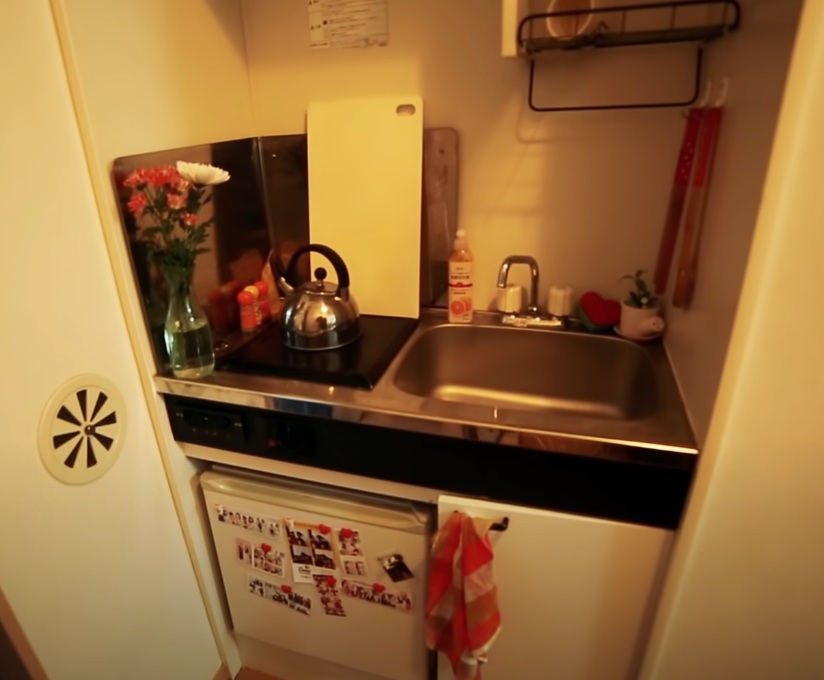
Where is `white cutting board`? white cutting board is located at coordinates (368, 154), (465, 647).